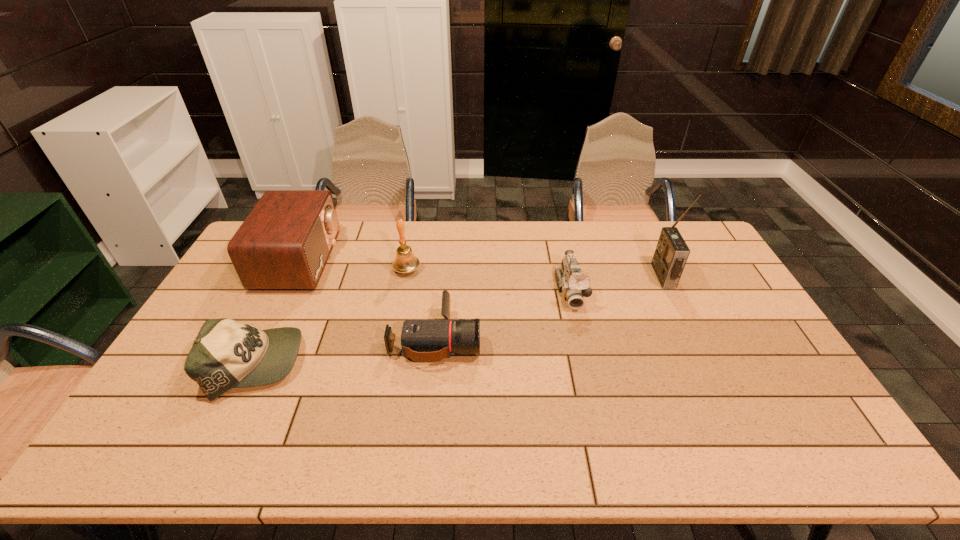
Image resolution: width=960 pixels, height=540 pixels. In order to click on free space between the left camcorder and the bell in this screenshot , I will do `click(421, 304)`.

Image resolution: width=960 pixels, height=540 pixels. What are the coordinates of `vacant region between the bell and the shorter radio receiver` in the screenshot? It's located at (354, 265).

In order to click on vacant region between the fifth object from left to right and the left radio receiver in this screenshot , I will do (x=436, y=275).

Where is `free space between the left camcorder and the taller radio receiver`? This screenshot has height=540, width=960. free space between the left camcorder and the taller radio receiver is located at coordinates (549, 307).

Find the location of a particular element. vacant space that's between the bell and the left radio receiver is located at coordinates (354, 265).

Choose which object is the nearest neighbor to the tallest object. Please provide its 2D coordinates. Your answer should be formatted as a tuple, i.e. [(x, y)], where the tuple contains the x and y coordinates of a point satisfying the conditions above.

[(574, 285)]

Locate an element on the screen. The height and width of the screenshot is (540, 960). the fourth closest object to the bell is located at coordinates (574, 285).

Locate an element on the screen. free space that satisfies the following two spatial constraints: 1. on the front-facing side of the taller camcorder; 2. on the front-facing side of the baseball cap is located at coordinates (588, 364).